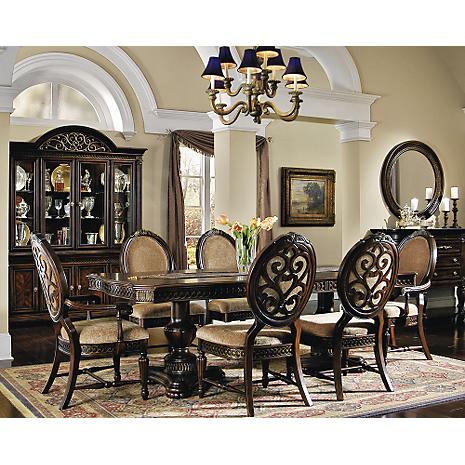
Find the location of a particular element. Image resolution: width=465 pixels, height=465 pixels. lights in chandelier is located at coordinates (214, 74), (225, 63), (253, 69), (265, 50), (273, 71), (291, 76), (299, 86).